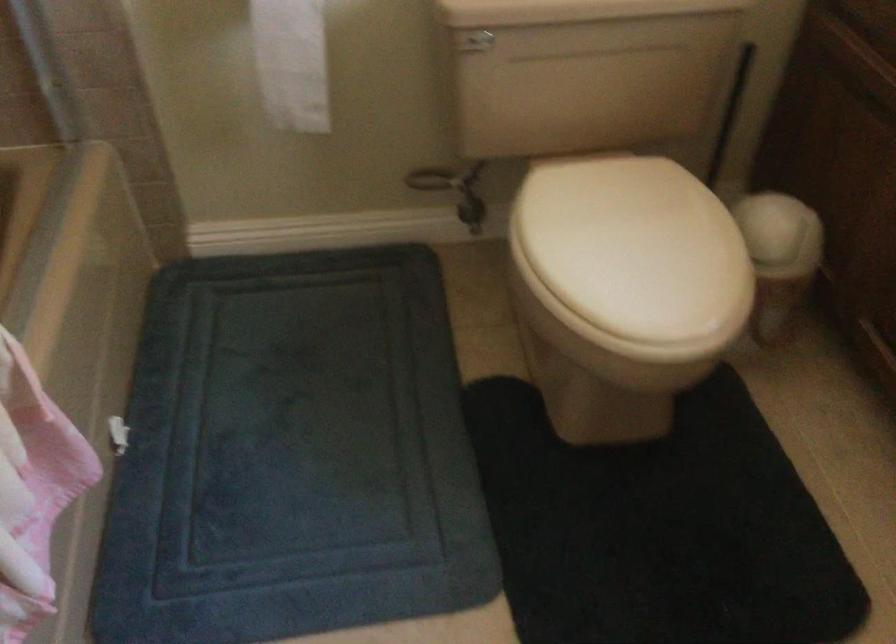
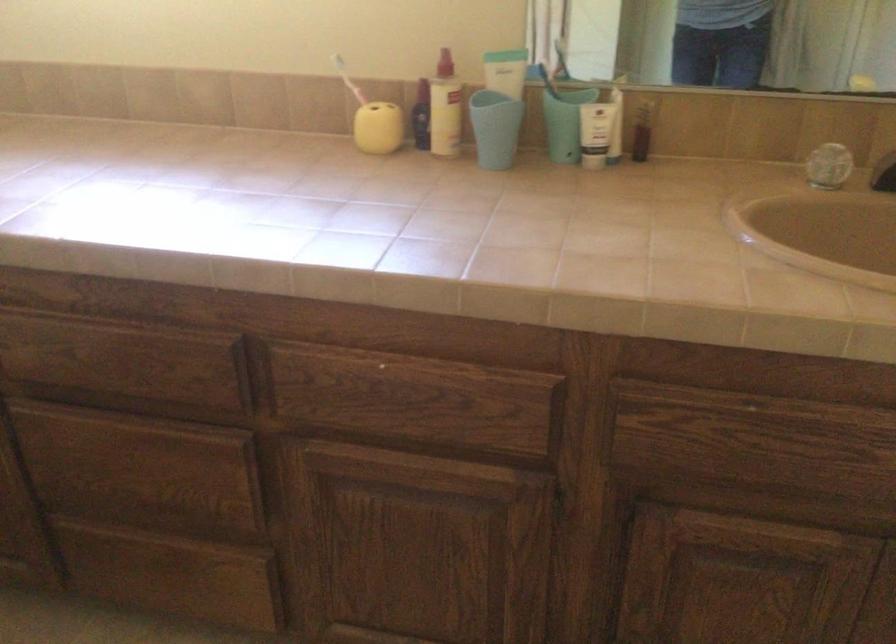
Question: The first image is from the beginning of the video and the second image is from the end. How did the camera likely rotate when shooting the video?

Choices:
 (A) Left
 (B) Right
 (C) Up
 (D) Down

Answer: (B)